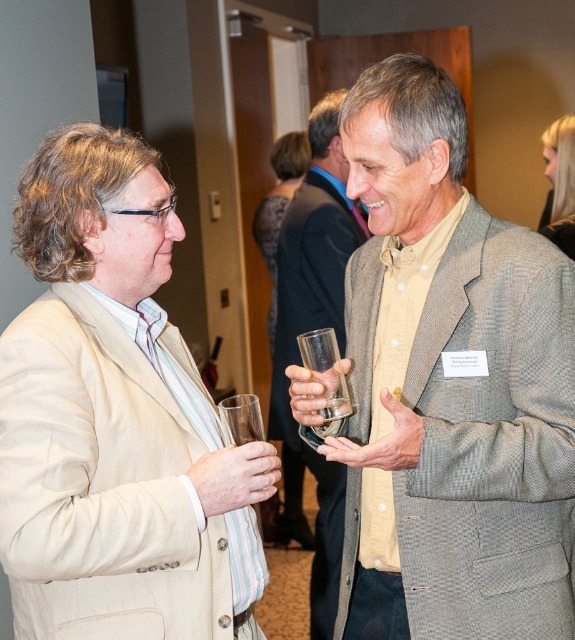
You are standing in the hallway and need to locate the dark gray textured dress at center. According to the coordinates provided, where should you look relative to the center of the image?

The dark gray textured dress at center is located at coordinates point (278, 209), which means it is slightly to the left and above the center point of the image.

Looking at this image, you are a photographer at the event and need to capture a photo of both the dark gray textured dress at center and the transparent glass at left. Given that your camera has a depth of field that can focus on objects within 8 feet, will both subjects be in focus?

The distance between the dark gray textured dress at center and the transparent glass at left is 8.30 feet, which exceeds the camera sensor depth of field of 8 feet. Therefore, both subjects cannot be in focus simultaneously.

You are at a conference and need to grab your drink quickly. Which object is closer to you between the light gray textured coat at upper right and the transparent glass at left?

The transparent glass at left is closer to you since it is positioned lower than the light gray textured coat at upper right, which is above it.